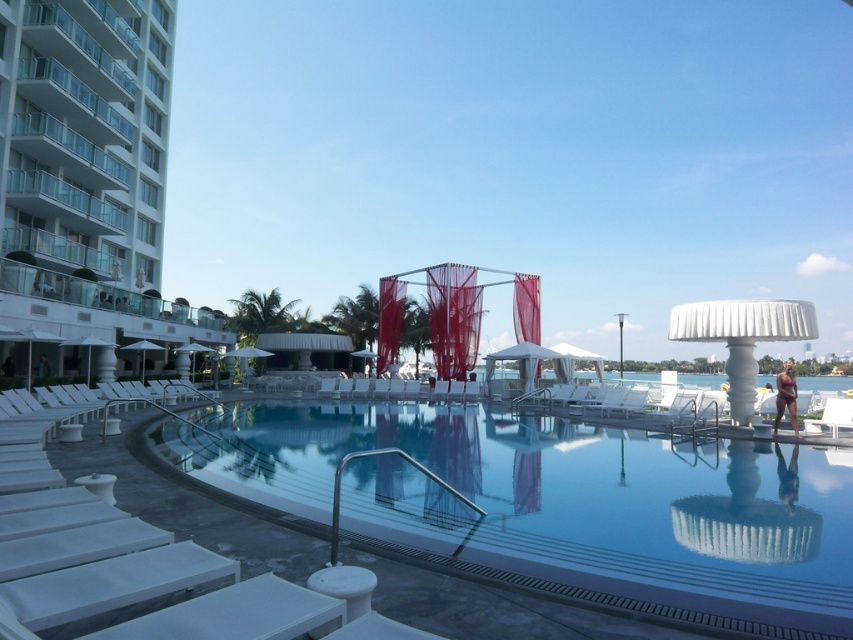
Question: Is clear glass pool at center wider than white glass building at left?

Choices:
 (A) yes
 (B) no

Answer: (A)

Question: Can you confirm if clear glass pool at center is positioned to the left of white glass building at left?

Choices:
 (A) yes
 (B) no

Answer: (B)

Question: Which object appears farthest from the camera in this image?

Choices:
 (A) clear glass pool at center
 (B) white glass building at left

Answer: (B)

Question: Can you confirm if clear glass pool at center is bigger than white glass building at left?

Choices:
 (A) no
 (B) yes

Answer: (A)

Question: Among these points, which one is farthest from the camera?

Choices:
 (A) (722, 512)
 (B) (165, 90)

Answer: (B)

Question: Which of the following is the farthest from the observer?

Choices:
 (A) white glass building at left
 (B) clear glass pool at center

Answer: (A)